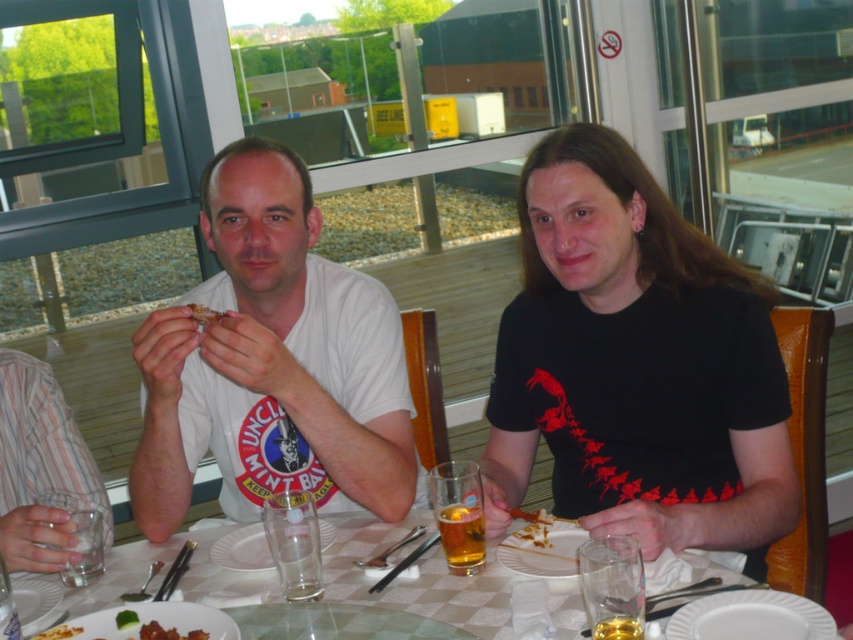
Question: Is golden glass beer at center further to the viewer compared to white porcelain plate at center?

Choices:
 (A) yes
 (B) no

Answer: (A)

Question: Which point is farther to the camera?

Choices:
 (A) clear glass table at center
 (B) golden glass beer at center

Answer: (B)

Question: Is white ceramic plate at lower right smaller than brown crumbly food at center?

Choices:
 (A) yes
 (B) no

Answer: (B)

Question: Which point appears farthest from the camera in this image?

Choices:
 (A) (317, 404)
 (B) (540, 572)
 (C) (786, 600)

Answer: (A)

Question: Among these points, which one is nearest to the camera?

Choices:
 (A) (793, 611)
 (B) (212, 557)
 (C) (456, 548)

Answer: (A)

Question: Can you confirm if white porcelain plate at center is bigger than translucent glass beer at center?

Choices:
 (A) yes
 (B) no

Answer: (A)